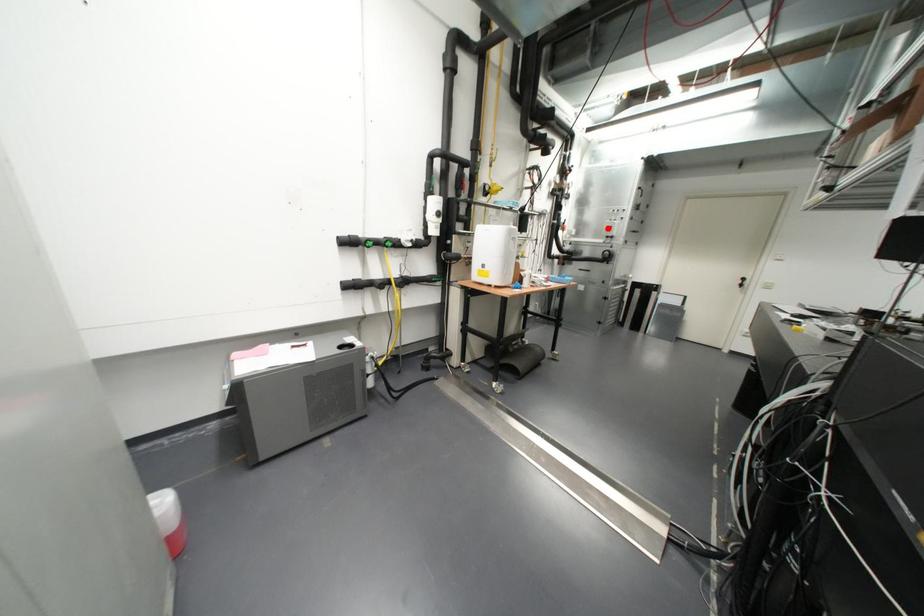
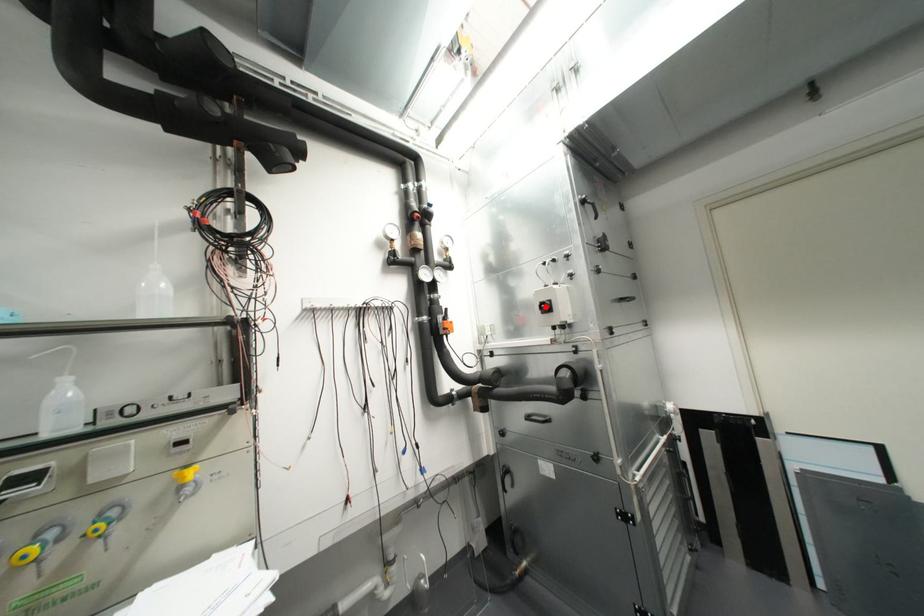
I am providing you with two images of the same scene from different viewpoints. A red point is marked on the first image and another point is marked on the second image. Do the highlighted points in image1 and image2 indicate the same real-world spot?

Yes